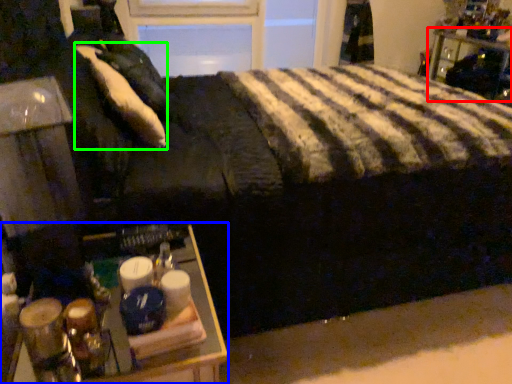
Question: Estimate the real-world distances between objects in this image. Which object is farther from furniture (highlighted by a red box), table (highlighted by a blue box) or pillow (highlighted by a green box)?

Choices:
 (A) table
 (B) pillow

Answer: (A)